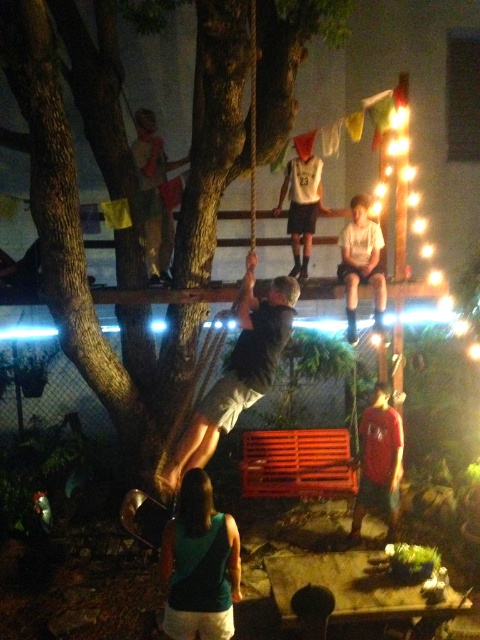
Question: Observing the image, what is the correct spatial positioning of dark gray fabric at center in reference to white jersey at center?

Choices:
 (A) left
 (B) right

Answer: (A)

Question: Which of the following is the closest to the observer?

Choices:
 (A) (285, 186)
 (B) (303, 612)

Answer: (B)

Question: Can you confirm if camouflage fabric shirt at upper left is positioned to the left of smooth brown skin at center?

Choices:
 (A) no
 (B) yes

Answer: (B)

Question: Which is farther from the dark gray fabric at center?

Choices:
 (A) smooth brown skin at center
 (B) teal fabric tank top at lower center
 (C) camouflage fabric shirt at upper left
 (D) brown rough tree trunk at center

Answer: (C)

Question: Is brown rough tree trunk at center below camouflage fabric shirt at upper left?

Choices:
 (A) yes
 (B) no

Answer: (B)

Question: Which object appears closest to the camera in this image?

Choices:
 (A) teal fabric tank top at lower center
 (B) matte red t-shirt at lower right
 (C) dark gray fabric at center

Answer: (A)